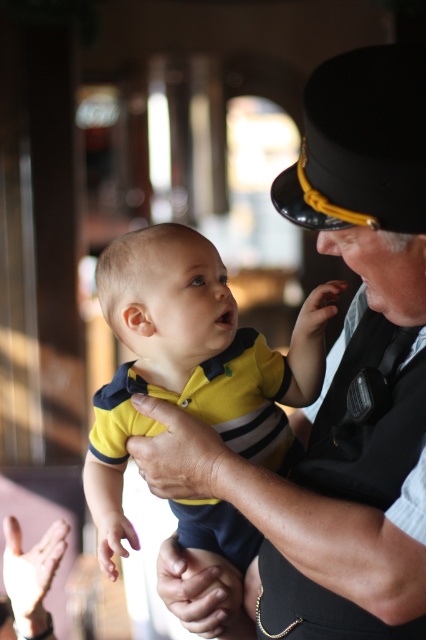
Question: Is matte black uniform at center to the right of black leather vest at center from the viewer's perspective?

Choices:
 (A) no
 (B) yes

Answer: (A)

Question: Which point appears closest to the camera in this image?

Choices:
 (A) (345, 600)
 (B) (104, 561)

Answer: (A)

Question: Which object is the closest to the yellow matte shirt at center?

Choices:
 (A) black leather vest at center
 (B) matte black uniform at center

Answer: (B)

Question: Which object is closer to the camera taking this photo?

Choices:
 (A) black leather vest at center
 (B) matte black uniform at center

Answer: (B)

Question: Does matte black uniform at center appear over black leather vest at center?

Choices:
 (A) no
 (B) yes

Answer: (B)

Question: Is yellow matte shirt at center above black leather vest at center?

Choices:
 (A) no
 (B) yes

Answer: (B)